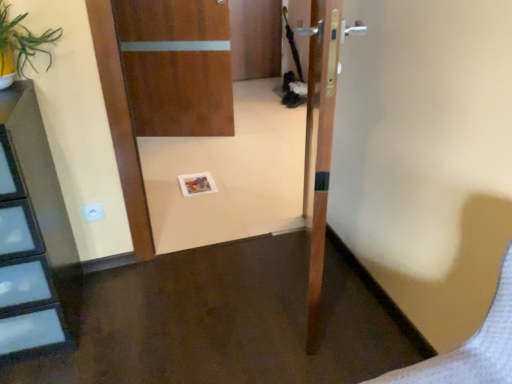
The height and width of the screenshot is (384, 512). I want to click on free space in front of wooden door at center, placed as the 1th door when sorted from back to front, so click(190, 154).